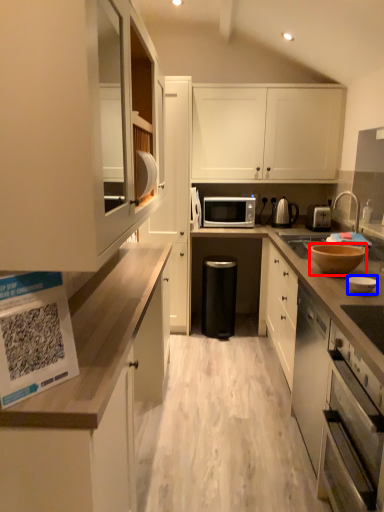
Question: Which object appears closest to the camera in this image, bowl (highlighted by a red box) or bowl (highlighted by a blue box)?

Choices:
 (A) bowl
 (B) bowl

Answer: (B)